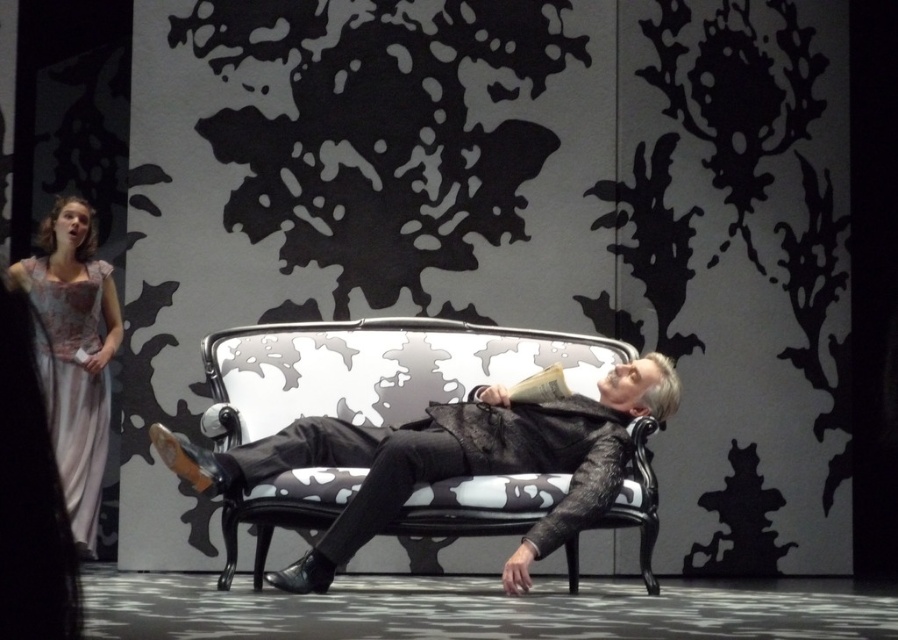
Question: Which object is closer to the camera taking this photo?

Choices:
 (A) silky satin gown at left
 (B) black leather couch at center

Answer: (B)

Question: Is black leather couch at center above silky satin gown at left?

Choices:
 (A) yes
 (B) no

Answer: (B)

Question: Can you confirm if black leather couch at center is bigger than silky satin gown at left?

Choices:
 (A) no
 (B) yes

Answer: (B)

Question: Does black leather couch at center appear on the right side of silky satin gown at left?

Choices:
 (A) no
 (B) yes

Answer: (B)